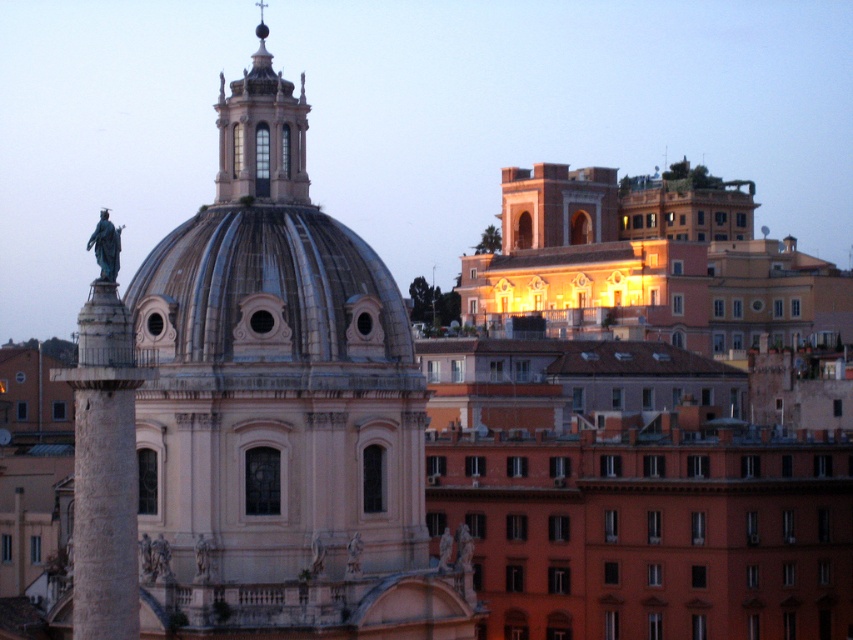
Question: Can you confirm if matte orange building at upper right is smaller than stone column at left?

Choices:
 (A) no
 (B) yes

Answer: (A)

Question: Which of these objects is positioned farthest from the stone column at left?

Choices:
 (A) matte orange building at upper right
 (B) shiny metallic dome at center

Answer: (A)

Question: Which object is farther from the camera taking this photo?

Choices:
 (A) matte orange building at upper right
 (B) stone column at left
 (C) shiny metallic dome at center

Answer: (A)

Question: Can you confirm if shiny metallic dome at center is smaller than stone column at left?

Choices:
 (A) yes
 (B) no

Answer: (A)

Question: Can you confirm if matte orange building at upper right is wider than stone column at left?

Choices:
 (A) no
 (B) yes

Answer: (B)

Question: Which of the following is the closest to the observer?

Choices:
 (A) stone column at left
 (B) matte orange building at upper right

Answer: (A)